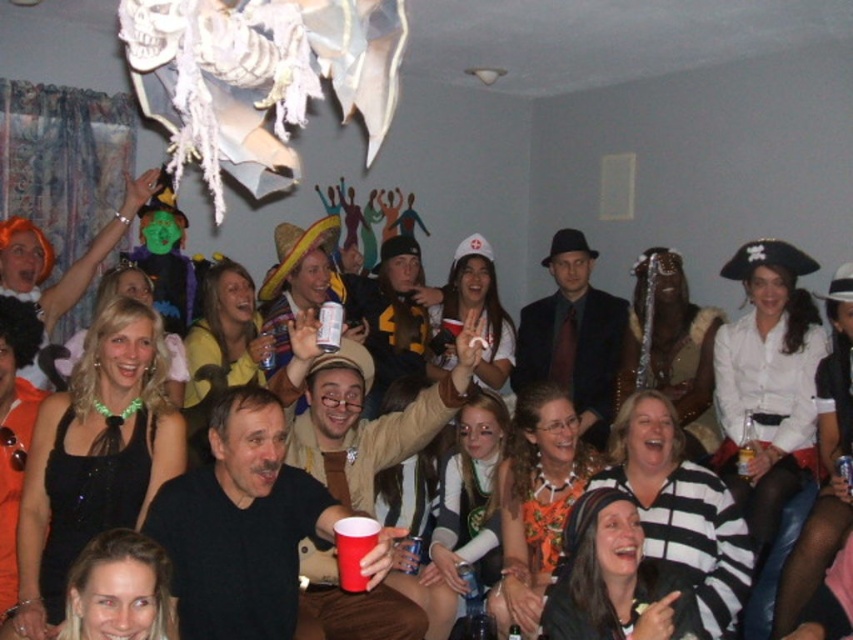
Question: Based on their relative distances, which object is farther from the red plastic cup at center?

Choices:
 (A) rubber cup at lower center
 (B) black sequined dress at lower left

Answer: (A)

Question: Is rubber cup at lower center behind red plastic cup at center?

Choices:
 (A) no
 (B) yes

Answer: (A)

Question: Which point appears farthest from the camera in this image?

Choices:
 (A) (109, 460)
 (B) (323, 333)
 (C) (335, 538)

Answer: (B)

Question: Which point is closer to the camera?

Choices:
 (A) translucent plastic cup at center
 (B) red plastic cup at center
 (C) black sequined dress at lower left
 (D) rubber cup at lower center

Answer: (D)

Question: In this image, where is black sequined dress at lower left located relative to red plastic cup at center?

Choices:
 (A) right
 (B) left

Answer: (B)

Question: Is red plastic cup at center to the left of translucent plastic cup at center from the viewer's perspective?

Choices:
 (A) no
 (B) yes

Answer: (B)